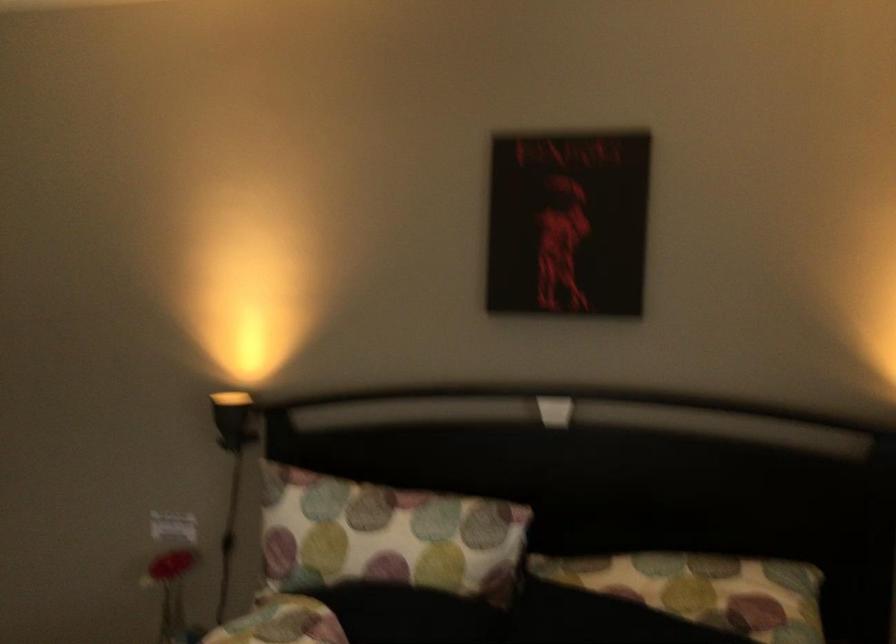
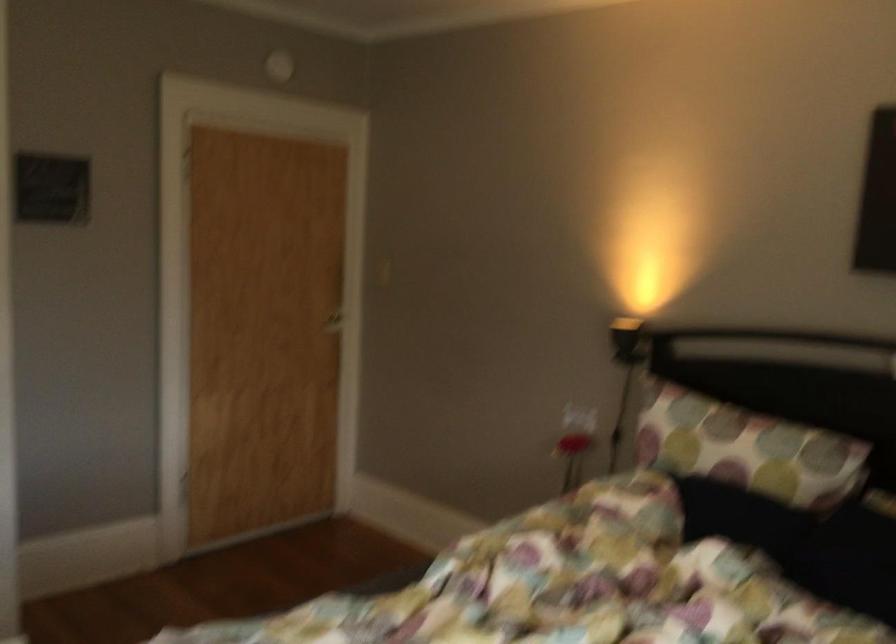
In the second image, find the point that corresponds to (400,535) in the first image.

(746, 449)